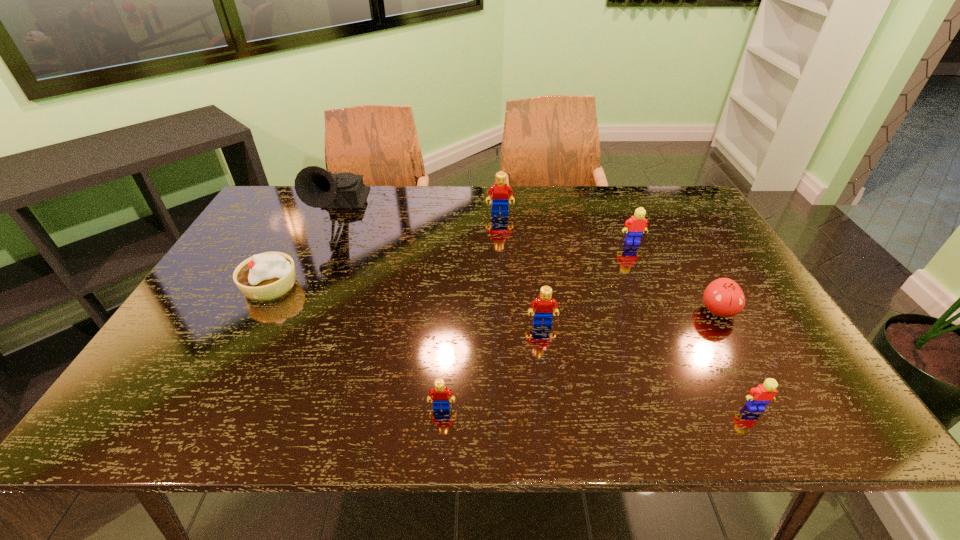
I want to click on free space at the near left corner, so click(x=197, y=398).

Identify the location of free spot between the farther yellow Lego and the fifth object from left to right. (588, 283).

Locate an element on the screen. free space between the red apple and the left yellow Lego is located at coordinates (675, 276).

I want to click on vacant space that is in between the nearest red Lego and the red apple, so click(580, 359).

You are a GUI agent. You are given a task and a screenshot of the screen. Output one action in this format:
    pyautogui.click(x=<x>, y=<y>)
    Task: Click on the blank region between the third object from right to left and the red apple
    The height and width of the screenshot is (540, 960).
    Given the screenshot: What is the action you would take?
    pyautogui.click(x=675, y=276)

This screenshot has width=960, height=540. I want to click on free space between the nearest red Lego and the right yellow Lego, so click(x=598, y=407).

What are the coordinates of `empty space between the phonograph_record and the whipped cream` in the screenshot? It's located at [x=304, y=248].

I want to click on free space that is in between the apple and the sixth object from right to left, so click(x=580, y=359).

You are a GUI agent. You are given a task and a screenshot of the screen. Output one action in this format:
    pyautogui.click(x=<x>, y=<y>)
    Task: Click on the free space between the second red Lego from left to right and the second farthest red Lego
    This screenshot has width=960, height=540.
    Given the screenshot: What is the action you would take?
    pyautogui.click(x=521, y=268)

This screenshot has width=960, height=540. What are the coordinates of `unoccupied position between the whipped cream and the black phonograph_record` in the screenshot? It's located at (304, 248).